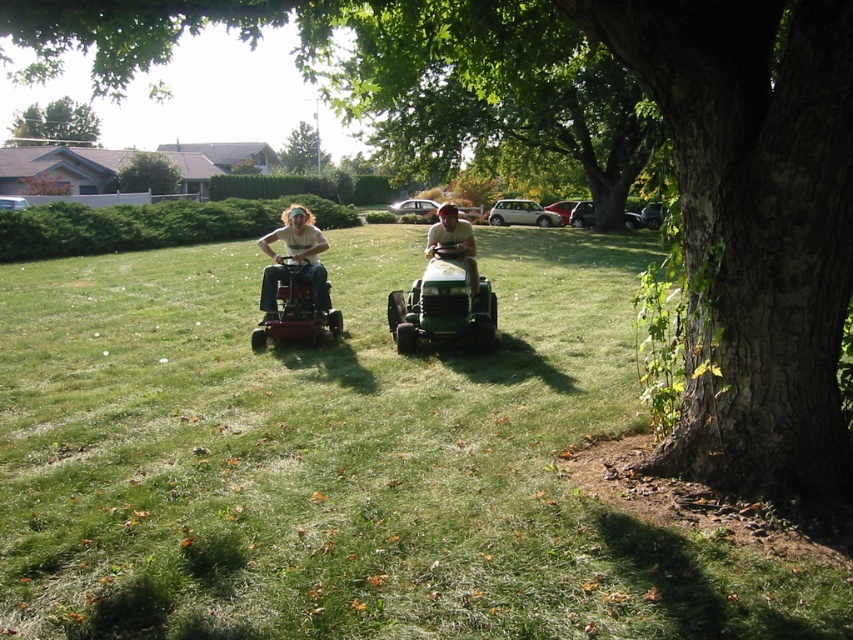
Question: Which point appears closest to the camera in this image?

Choices:
 (A) (9, 129)
 (B) (656, 612)
 (C) (300, 228)

Answer: (B)

Question: From the image, what is the correct spatial relationship of green grass at center in relation to green leafy tree at upper center?

Choices:
 (A) right
 (B) left

Answer: (A)

Question: Is green leafy tree at upper left below green plastic lawn mower at center?

Choices:
 (A) yes
 (B) no

Answer: (B)

Question: Among these objects, which one is nearest to the camera?

Choices:
 (A) green leafy tree at upper center
 (B) green grass at center
 (C) green plastic lawn mower at center

Answer: (B)

Question: Based on their relative distances, which object is farther from the green plastic lawn mower at center?

Choices:
 (A) green leafy tree at center
 (B) matte green lawn mower at center
 (C) green leafy tree at upper center

Answer: (A)

Question: Is the position of matte green lawn mower at center less distant than that of green leafy tree at upper left?

Choices:
 (A) no
 (B) yes

Answer: (B)